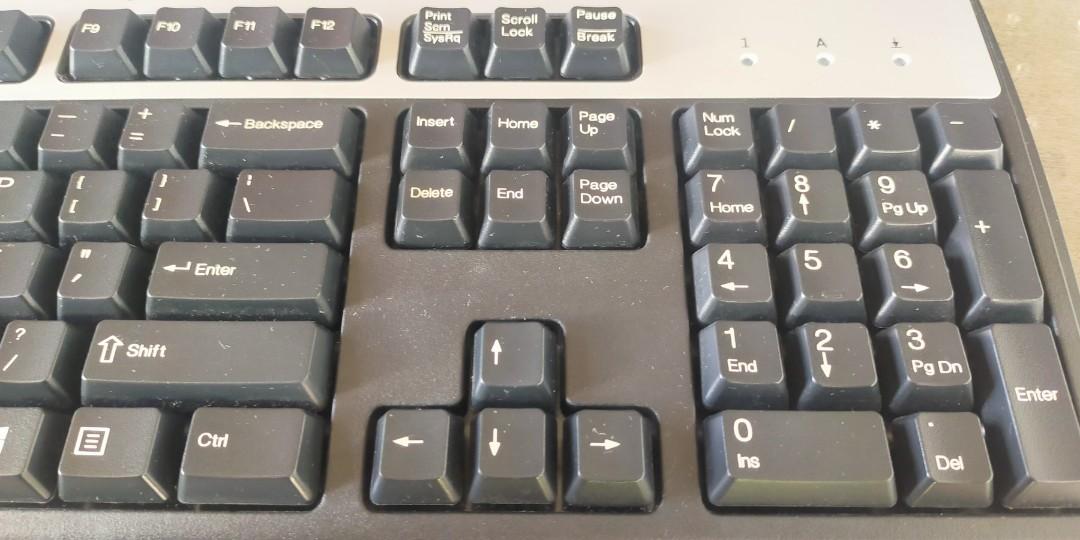
Locate an element on the screen. desk is located at coordinates (1051, 148).